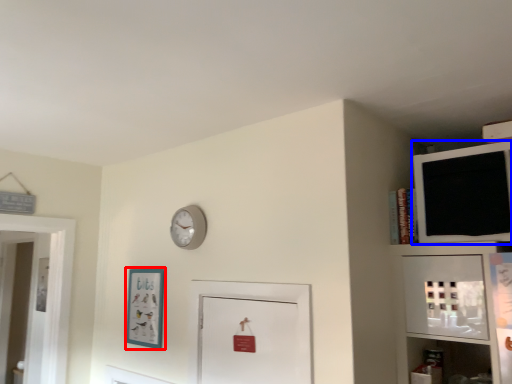
Question: Among these objects, which one is nearest to the camera, picture frame (highlighted by a red box) or medicine cabinet (highlighted by a blue box)?

Choices:
 (A) picture frame
 (B) medicine cabinet

Answer: (B)